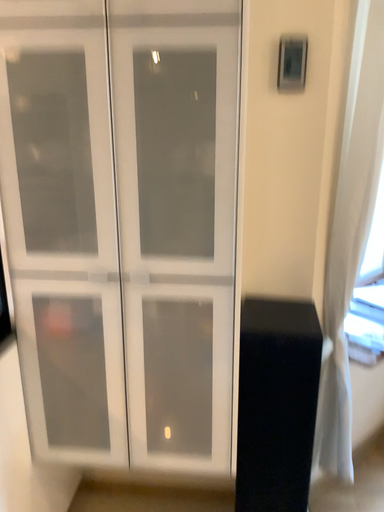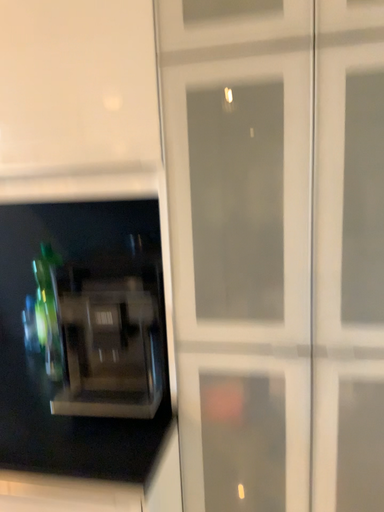
Question: Which way did the camera rotate in the video?

Choices:
 (A) rotated left
 (B) rotated right

Answer: (A)